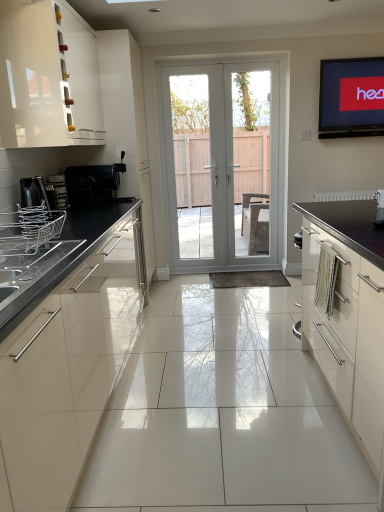
Question: Should I look upward or downward to see white glossy door at center, which is counted as the first screen door, starting from the right?

Choices:
 (A) up
 (B) down

Answer: (A)

Question: Would you say white glossy cabinet at upper left, marked as the second cabinetry in a right-to-left arrangement, contains satin silver toaster at left, the second appliance positioned from the back?

Choices:
 (A) yes
 (B) no

Answer: (B)

Question: Is white glossy cabinet at upper left, which is the first cabinetry in top-to-bottom order, far from satin silver toaster at left, the 2th appliance viewed from the top?

Choices:
 (A) yes
 (B) no

Answer: (B)

Question: Can you confirm if white glossy cabinet at upper left, marked as the second cabinetry in a right-to-left arrangement, is shorter than satin silver toaster at left, the second appliance from the front?

Choices:
 (A) no
 (B) yes

Answer: (A)

Question: Considering the relative positions of white glossy cabinet at upper left, which is the 2th cabinetry in bottom-to-top order, and satin silver toaster at left, the second appliance from the front, in the image provided, is white glossy cabinet at upper left, which is the 2th cabinetry in bottom-to-top order, to the left of satin silver toaster at left, the second appliance from the front, from the viewer's perspective?

Choices:
 (A) yes
 (B) no

Answer: (B)

Question: Is white glossy cabinet at upper left, which is the first cabinetry in top-to-bottom order, facing away from satin silver toaster at left, the 2th appliance viewed from the top?

Choices:
 (A) no
 (B) yes

Answer: (A)

Question: From the image's perspective, is white glossy cabinet at upper left, which appears as the 1th cabinetry when viewed from the left, below satin silver toaster at left, the second appliance from the front?

Choices:
 (A) yes
 (B) no

Answer: (B)

Question: From the image's perspective, does white glossy cabinet at right, the second cabinetry positioned from the left, appear higher than satin silver toaster at left, the 2th appliance viewed from the top?

Choices:
 (A) yes
 (B) no

Answer: (B)

Question: From the image's perspective, does white glossy cabinet at right, which is counted as the 2th cabinetry, starting from the top, appear lower than satin silver toaster at left, the second appliance from the front?

Choices:
 (A) no
 (B) yes

Answer: (B)

Question: Can you confirm if white glossy cabinet at right, the second cabinetry positioned from the left, is smaller than satin silver toaster at left, arranged as the 2th appliance when ordered from the bottom?

Choices:
 (A) yes
 (B) no

Answer: (B)

Question: Is satin silver toaster at left, the second appliance from the front, at the back of white glossy cabinet at right, the second cabinetry positioned from the left?

Choices:
 (A) no
 (B) yes

Answer: (A)

Question: Could you tell me if white glossy cabinet at right, the second cabinetry positioned from the left, is facing satin silver toaster at left, the 2th appliance viewed from the top?

Choices:
 (A) no
 (B) yes

Answer: (A)

Question: Can you see white glossy cabinet at right, which ranks as the 1th cabinetry in right-to-left order, touching satin silver toaster at left, the 2th appliance viewed from the top?

Choices:
 (A) no
 (B) yes

Answer: (A)

Question: From the image's perspective, does black matte coffee machine at left, placed as the third appliance when sorted from front to back, appear lower than clear glass door at center, which ranks as the 2th screen door in right-to-left order?

Choices:
 (A) no
 (B) yes

Answer: (B)